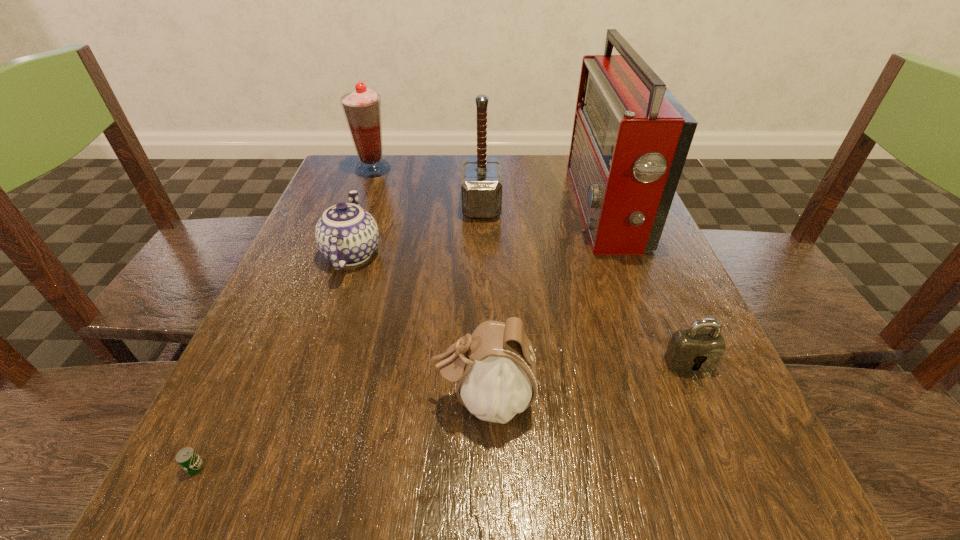
Where is `the sixth closest object to the beer can`? the sixth closest object to the beer can is located at coordinates (362, 108).